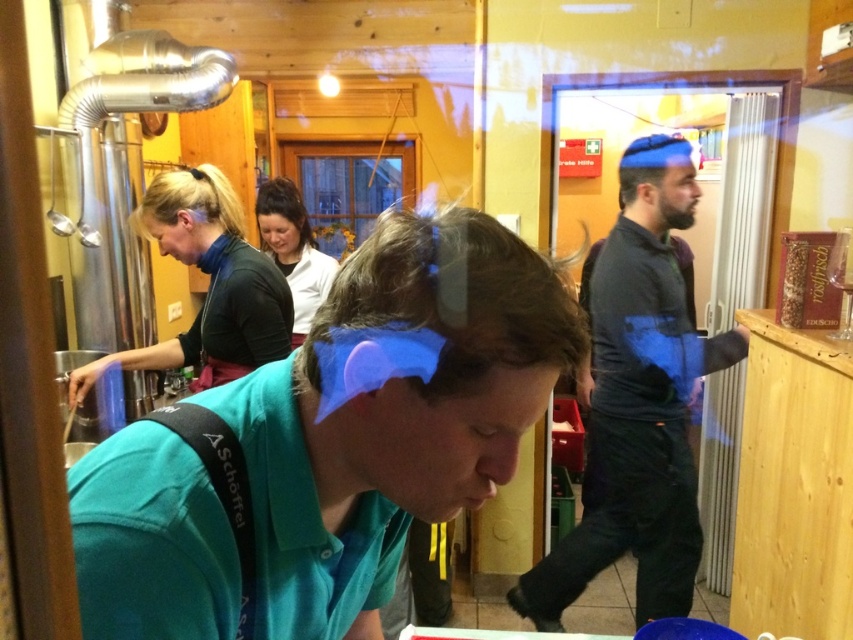
Question: Can you confirm if teal fabric shirt at center is thinner than dark gray sweater at center?

Choices:
 (A) no
 (B) yes

Answer: (B)

Question: Does teal fabric shirt at center appear on the right side of dark gray sweater at center?

Choices:
 (A) yes
 (B) no

Answer: (B)

Question: Which point is farther from the camera taking this photo?

Choices:
 (A) (254, 344)
 (B) (645, 595)

Answer: (B)

Question: Does teal fabric shirt at center have a lesser width compared to dark gray sweater at center?

Choices:
 (A) yes
 (B) no

Answer: (A)

Question: Which of the following is the closest to the observer?

Choices:
 (A) (231, 342)
 (B) (442, 266)

Answer: (B)

Question: Considering the real-world distances, which object is farthest from the dark gray sweater at center?

Choices:
 (A) teal fabric shirt at center
 (B) matte black shirt at center

Answer: (A)